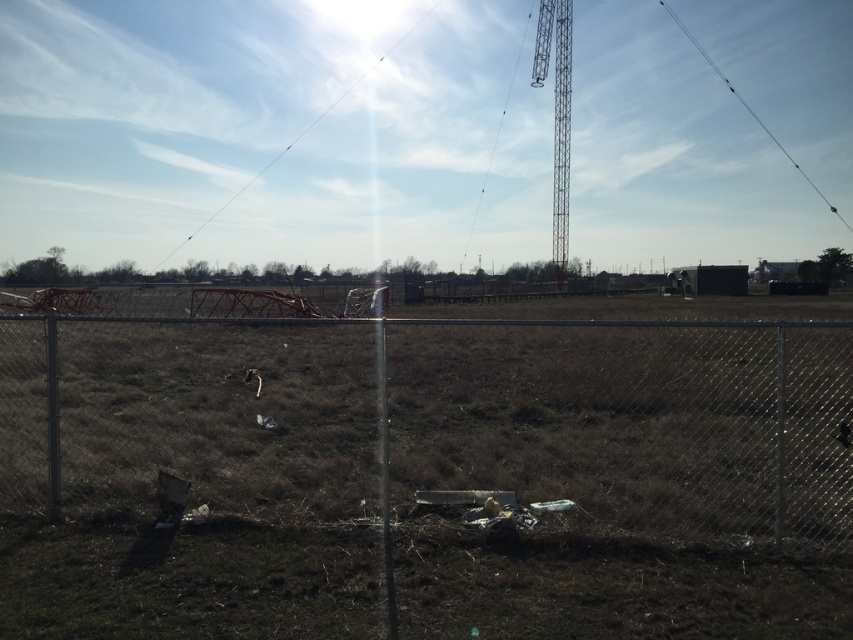
You are a photographer trying to capture a clear shot of the metallic tower at upper right and the black wire at upper right. Based on their positions, which object should you focus on first to ensure it appears in the foreground of your photo?

The metallic tower at upper right is located below the black wire at upper right, so focusing on the metallic tower at upper right first will ensure it appears in the foreground since it is closer to the camera.

You are an engineer inspecting the field and need to determine the relative sizes of the metallic tower at upper right and the transparent wire at upper center. Which object is narrower?

The metallic tower at upper right is narrower than the transparent wire at upper center.